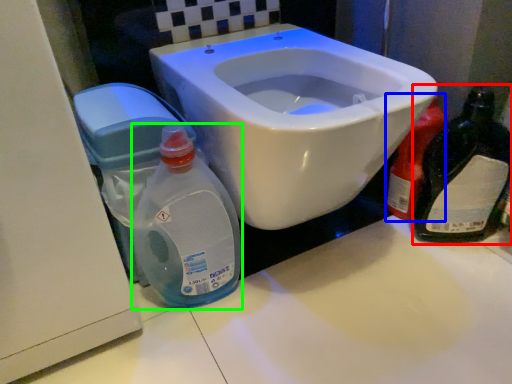
Question: Which object is positioned farthest from bottle (highlighted by a red box)? Select from cleaning product (highlighted by a blue box) and baby bottle (highlighted by a green box).

Choices:
 (A) cleaning product
 (B) baby bottle

Answer: (B)